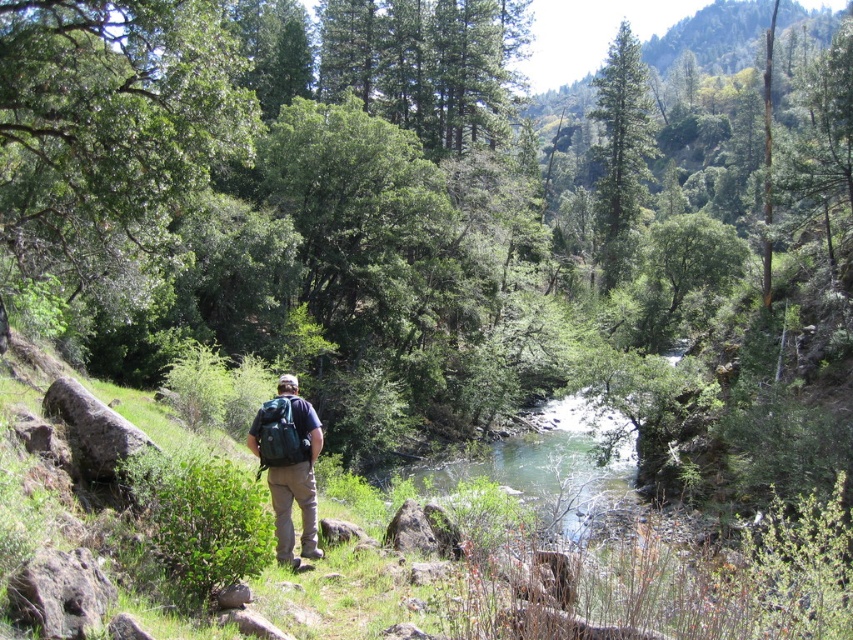
You are standing at the camera position and see the green textured pine tree at upper center. Can you determine if the pine tree is closer to the camera or further away compared to the person walking towards the river?

The green textured pine tree at upper center is located at point (619, 154), which places it further away from the camera compared to the person walking towards the river. Therefore, the pine tree is further away.

You are a hiker who wants to take a photo of the green textured pine tree at upper center and the teal fabric backpack at center. Which object should you focus on first if you want to capture both in the frame without moving the camera?

You should focus on the teal fabric backpack at center first because the green textured pine tree at upper center is positioned to the right of it, so adjusting focus to the backpack ensures both are in the frame without needing to reposition the camera.